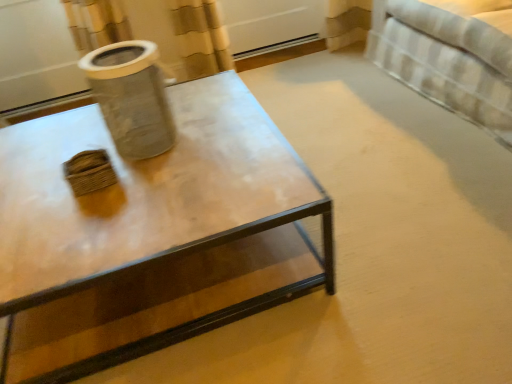
Question: From the image's perspective, is clear glass jar at upper left above or below white striped fabric bed at upper right?

Choices:
 (A) above
 (B) below

Answer: (B)

Question: Is clear glass jar at upper left taller or shorter than white striped fabric bed at upper right?

Choices:
 (A) short
 (B) tall

Answer: (A)

Question: Which is farther from the white striped fabric bed at upper right?

Choices:
 (A) matte glass coffee table at center
 (B) clear glass jar at upper left

Answer: (B)

Question: Which object is positioned closest to the matte glass coffee table at center?

Choices:
 (A) clear glass jar at upper left
 (B) white striped fabric bed at upper right

Answer: (A)